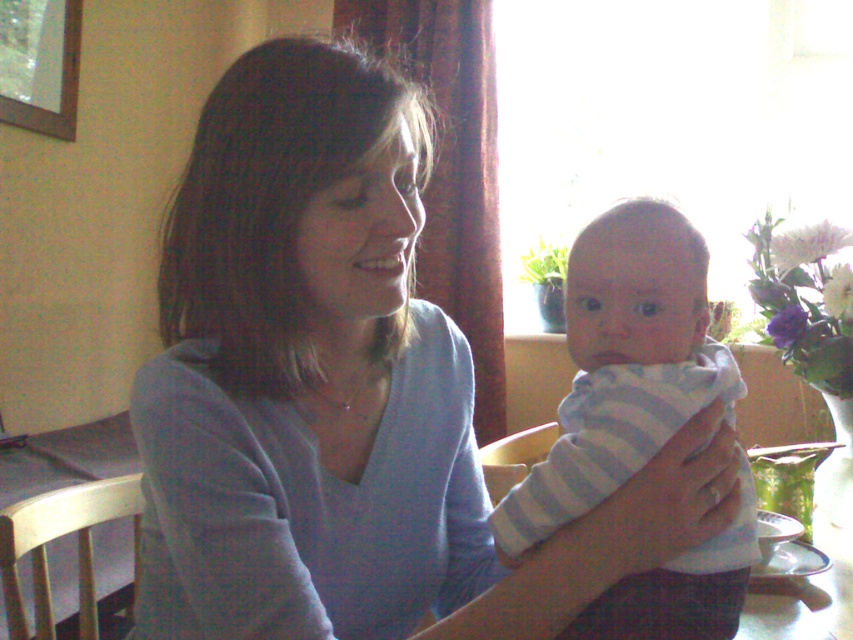
Question: Does matte blue sweater at center appear over light blue striped cloth at center?

Choices:
 (A) yes
 (B) no

Answer: (A)

Question: Can you confirm if matte blue sweater at center is positioned to the right of light blue striped cloth at center?

Choices:
 (A) yes
 (B) no

Answer: (B)

Question: Among these points, which one is nearest to the camera?

Choices:
 (A) (273, 182)
 (B) (630, 435)

Answer: (A)

Question: Which object is closer to the camera taking this photo?

Choices:
 (A) matte blue sweater at center
 (B) light blue striped cloth at center

Answer: (A)

Question: Can you confirm if matte blue sweater at center is smaller than light blue striped cloth at center?

Choices:
 (A) no
 (B) yes

Answer: (A)